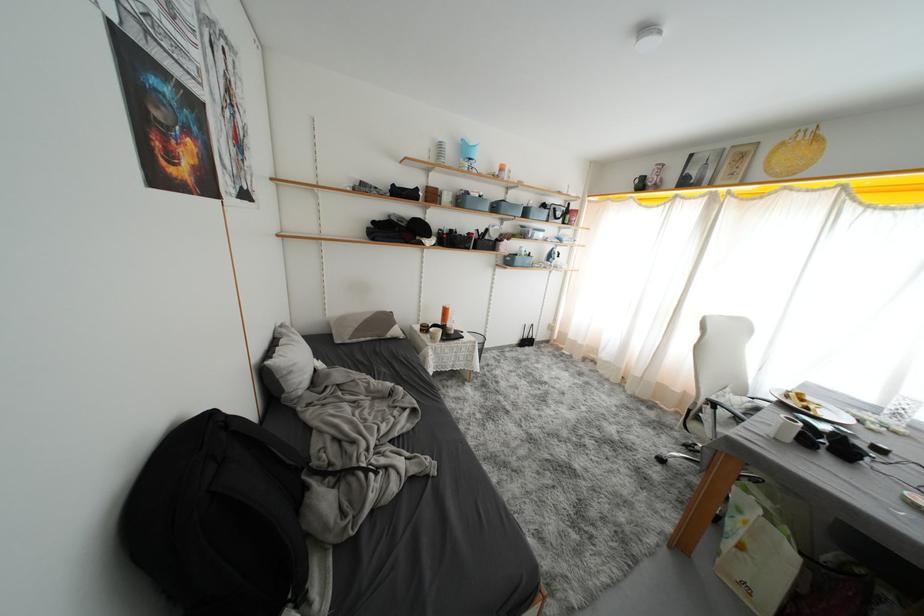
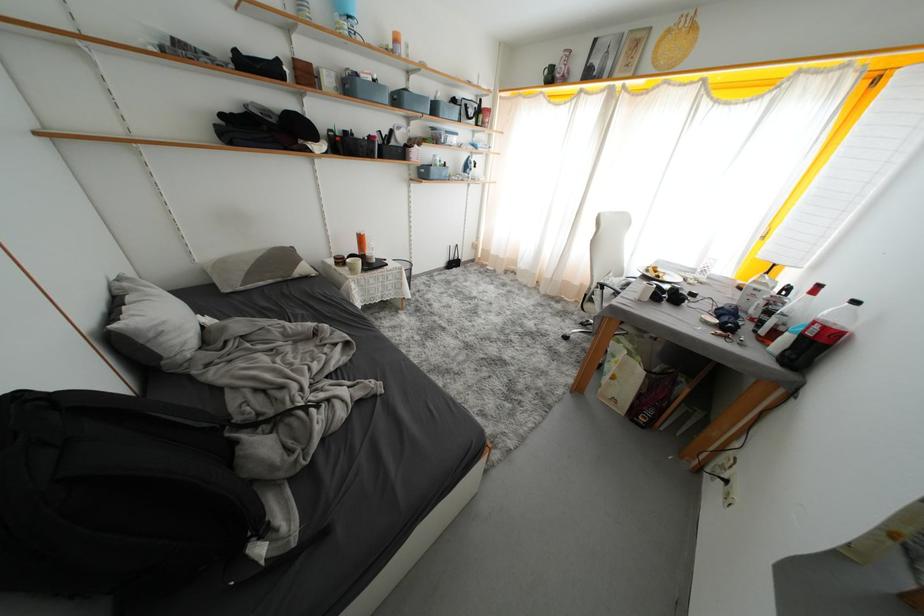
The first image is from the beginning of the video and the second image is from the end. How did the camera likely rotate when shooting the video?

The camera's rotation is toward right-down.